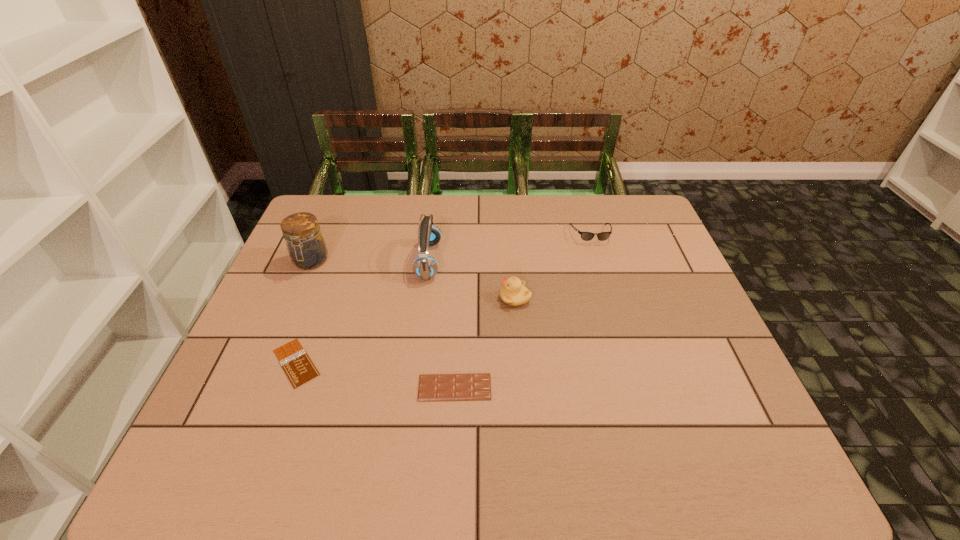
Where is `jar`? The width and height of the screenshot is (960, 540). jar is located at coordinates (307, 249).

At what (x,y) coordinates should I click in order to perform the action: click on headset. Please return your answer as a coordinate pair (x, y). The image size is (960, 540). Looking at the image, I should click on (425, 267).

Locate an element on the screen. the fourth shortest object is located at coordinates (514, 293).

The height and width of the screenshot is (540, 960). Identify the location of the fifth object from left to right. (514, 293).

Identify the location of the rightmost object. (586, 236).

This screenshot has width=960, height=540. In order to click on sunglasses in this screenshot , I will do `click(586, 236)`.

In order to click on the taller chocolate bar in this screenshot , I will do `click(432, 387)`.

Identify the location of the right chocolate bar. The image size is (960, 540). tap(432, 387).

Find the location of a particular element. This screenshot has height=540, width=960. the left chocolate bar is located at coordinates (297, 365).

Find the location of `the shortest object`. the shortest object is located at coordinates (297, 365).